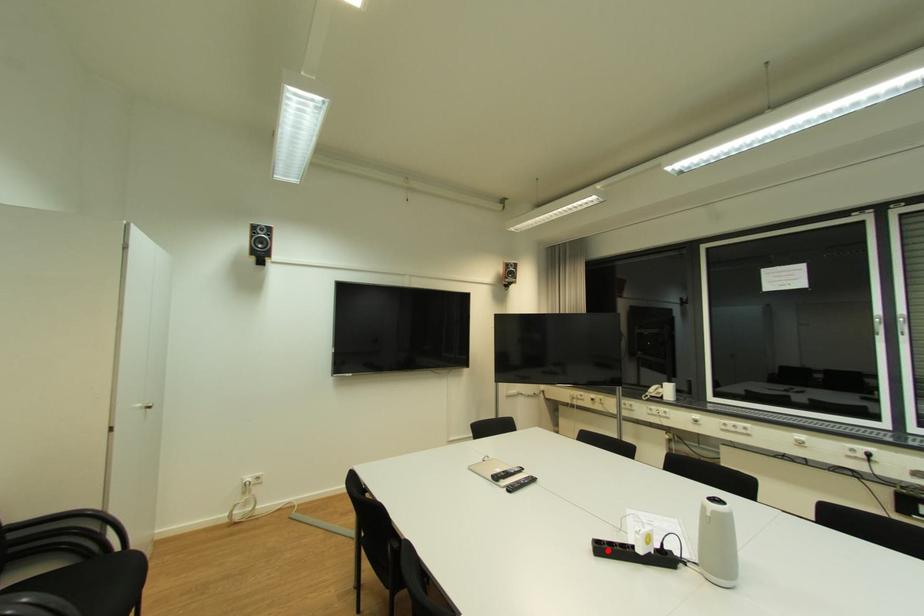
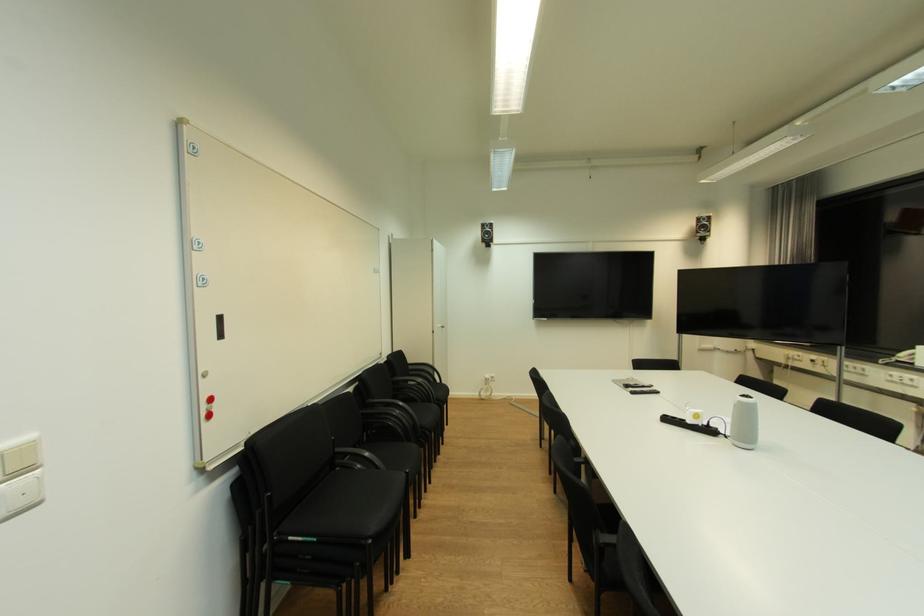
Where in the second image is the point corresponding to the highlighted location from the first image?

(674, 421)